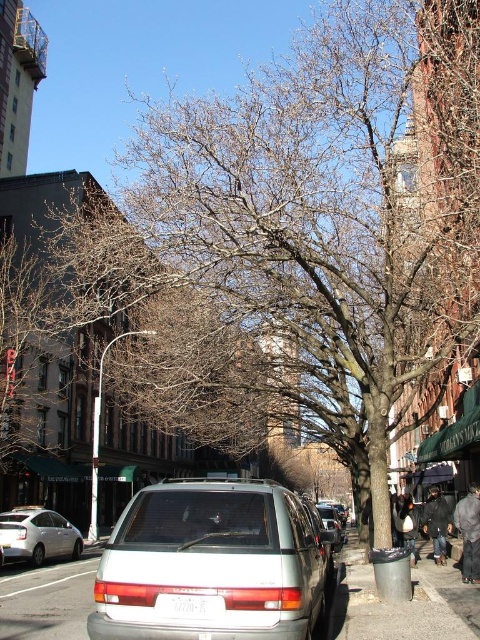
Question: Does white matte van at center have a larger size compared to white plastic license plate at center?

Choices:
 (A) yes
 (B) no

Answer: (A)

Question: In this image, where is dark gray fabric coat at lower right located relative to black leather jacket at lower right?

Choices:
 (A) left
 (B) right

Answer: (A)

Question: Is white plastic license plate at center behind matte silver van at center?

Choices:
 (A) yes
 (B) no

Answer: (B)

Question: Which object is closer to the camera taking this photo?

Choices:
 (A) matte silver van at center
 (B) silver metallic sedan at lower left
 (C) dark gray fabric coat at lower right

Answer: (A)

Question: Based on their relative distances, which object is farther from the gray asphalt pavement at lower center?

Choices:
 (A) black leather jacket at lower right
 (B) white matte van at center

Answer: (A)

Question: Which of the following is the farthest from the observer?

Choices:
 (A) pos(68,532)
 (B) pos(334,516)
 (C) pos(191,609)

Answer: (B)